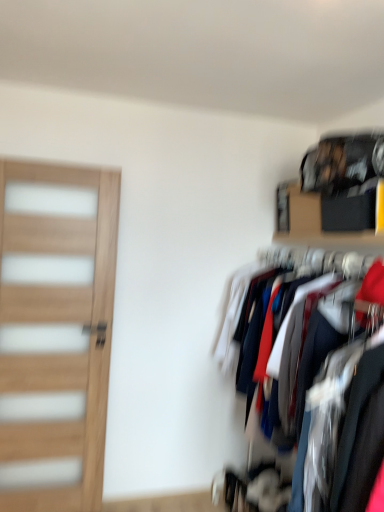
Question: Does wooden shelf at upper right have a larger size compared to wooden door at left?

Choices:
 (A) yes
 (B) no

Answer: (B)

Question: Is wooden shelf at upper right taller than wooden door at left?

Choices:
 (A) yes
 (B) no

Answer: (B)

Question: Considering the relative positions of wooden shelf at upper right and wooden door at left in the image provided, is wooden shelf at upper right to the right of wooden door at left from the viewer's perspective?

Choices:
 (A) no
 (B) yes

Answer: (B)

Question: Is wooden shelf at upper right turned away from wooden door at left?

Choices:
 (A) yes
 (B) no

Answer: (B)

Question: From a real-world perspective, is wooden shelf at upper right physically below wooden door at left?

Choices:
 (A) no
 (B) yes

Answer: (A)

Question: Is wooden shelf at upper right not inside wooden door at left?

Choices:
 (A) no
 (B) yes

Answer: (B)

Question: Is the depth of wooden door at left less than that of wooden shelf at upper right?

Choices:
 (A) yes
 (B) no

Answer: (B)

Question: Considering the relative sizes of wooden door at left and wooden shelf at upper right in the image provided, is wooden door at left shorter than wooden shelf at upper right?

Choices:
 (A) no
 (B) yes

Answer: (A)

Question: Considering the relative sizes of wooden door at left and wooden shelf at upper right in the image provided, is wooden door at left smaller than wooden shelf at upper right?

Choices:
 (A) no
 (B) yes

Answer: (A)

Question: Can you confirm if wooden door at left is positioned to the left of wooden shelf at upper right?

Choices:
 (A) no
 (B) yes

Answer: (B)

Question: Does wooden door at left have a greater width compared to wooden shelf at upper right?

Choices:
 (A) no
 (B) yes

Answer: (A)

Question: Would you say wooden door at left is a long distance from wooden shelf at upper right?

Choices:
 (A) no
 (B) yes

Answer: (B)

Question: From the image's perspective, is wooden shelf at upper right positioned above or below wooden door at left?

Choices:
 (A) above
 (B) below

Answer: (A)